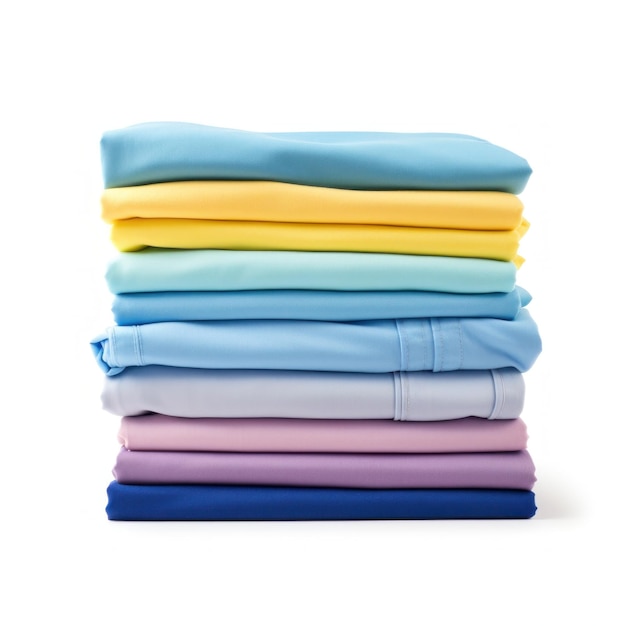
Where is `folded laundry`? Image resolution: width=626 pixels, height=626 pixels. folded laundry is located at coordinates (357, 163), (362, 196), (370, 233), (360, 264), (327, 300), (345, 341), (362, 390), (369, 433), (371, 470), (362, 501).